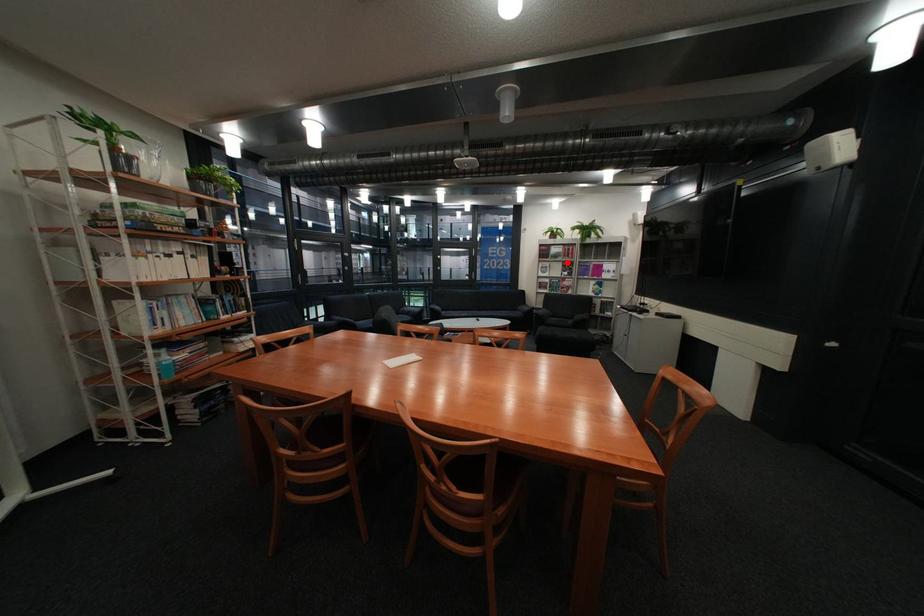
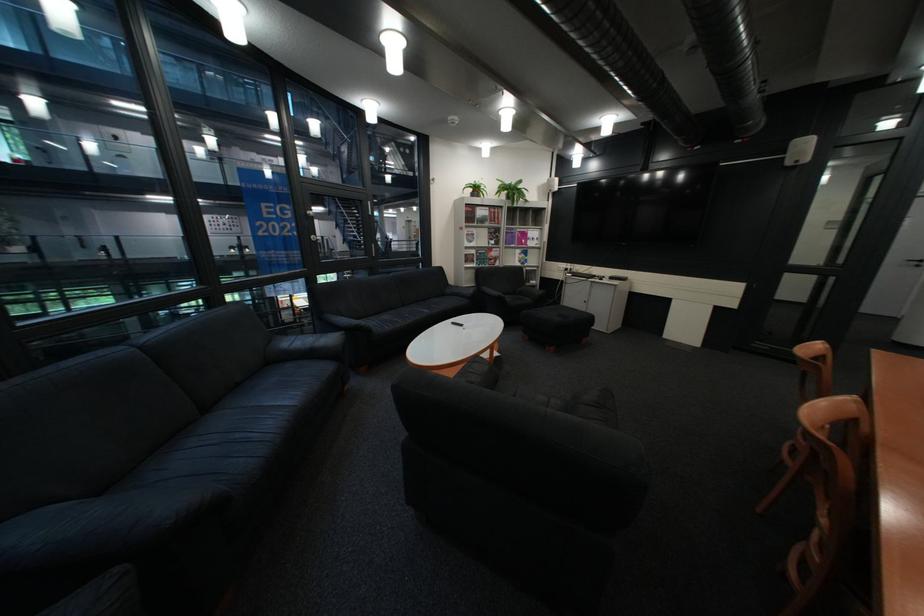
Locate, in the second image, the point that corresponds to the highlighted location in the first image.

(492, 229)